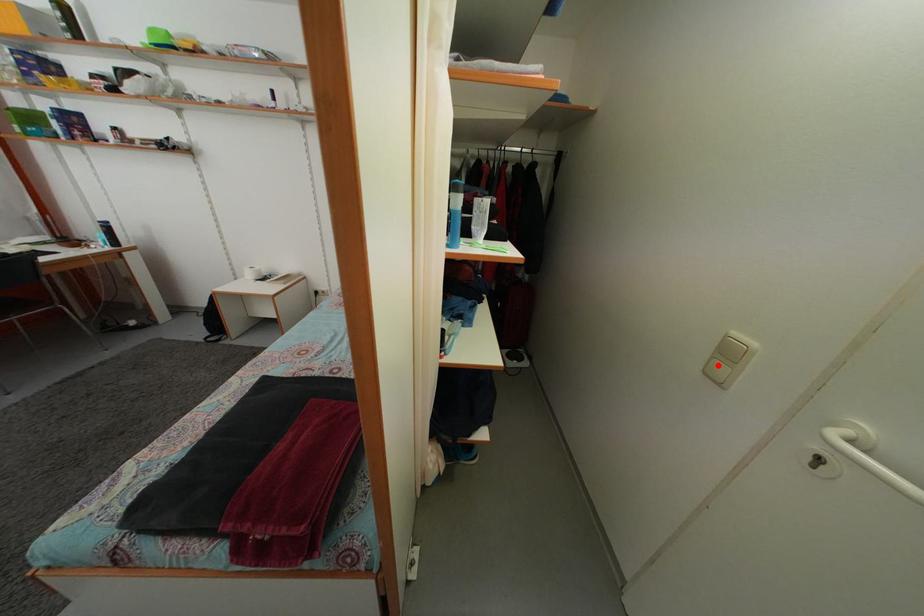
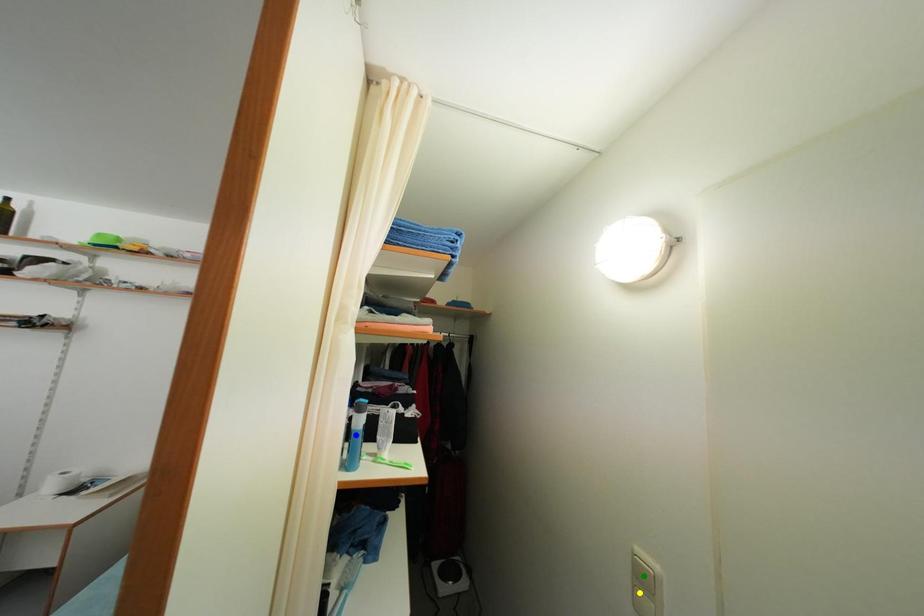
Question: I am providing you with two images of the same scene from different viewpoints. A red point is marked on the first image. You are given multiple points on the second image. Which point in image 2 is actually the same real-world point as the red point in image 1?

Choices:
 (A) yellow point
 (B) blue point
 (C) green point

Answer: (A)